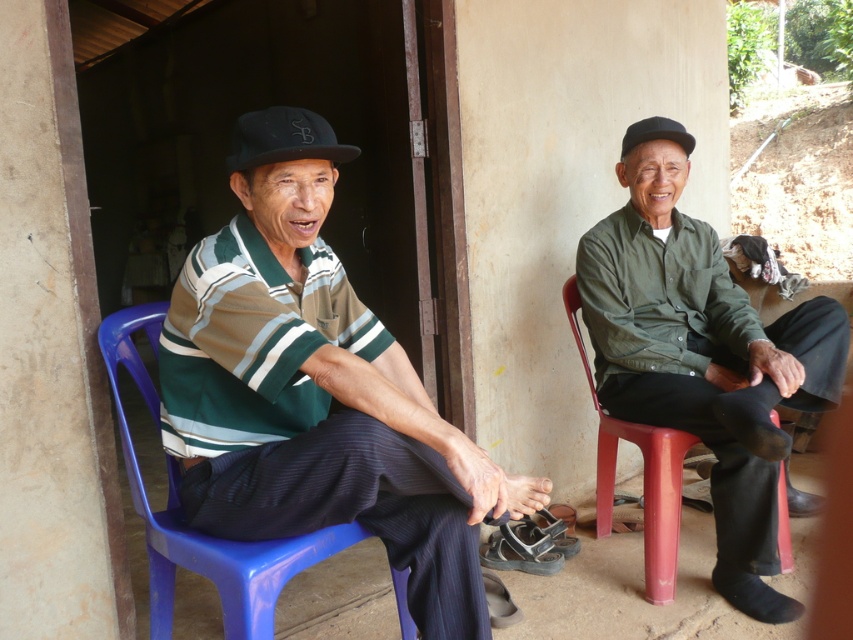
Between point (291, 554) and point (270, 161), which one is positioned behind?

The point (291, 554) is more distant.

Who is positioned more to the left, blue plastic chair at left or black matte cap at upper center?

Positioned to the left is blue plastic chair at left.

Between point (248, 598) and point (309, 113), which one is positioned behind?

The point (309, 113) is more distant.

Locate an element on the screen. Image resolution: width=853 pixels, height=640 pixels. blue plastic chair at left is located at coordinates (183, 520).

Does red plastic chair at right have a greater height compared to black fabric cap at upper right?

Yes.

Does point (666, 570) come behind point (675, 128)?

No, (666, 570) is in front of (675, 128).

Image resolution: width=853 pixels, height=640 pixels. I want to click on red plastic chair at right, so click(x=643, y=476).

Between red plastic chair at right and black matte cap at upper center, which one has less height?

black matte cap at upper center

Which is in front, point (674, 572) or point (258, 157)?

Positioned in front is point (258, 157).

Where is `red plastic chair at right`? This screenshot has width=853, height=640. red plastic chair at right is located at coordinates (643, 476).

Find the location of a particular element. The width and height of the screenshot is (853, 640). red plastic chair at right is located at coordinates (643, 476).